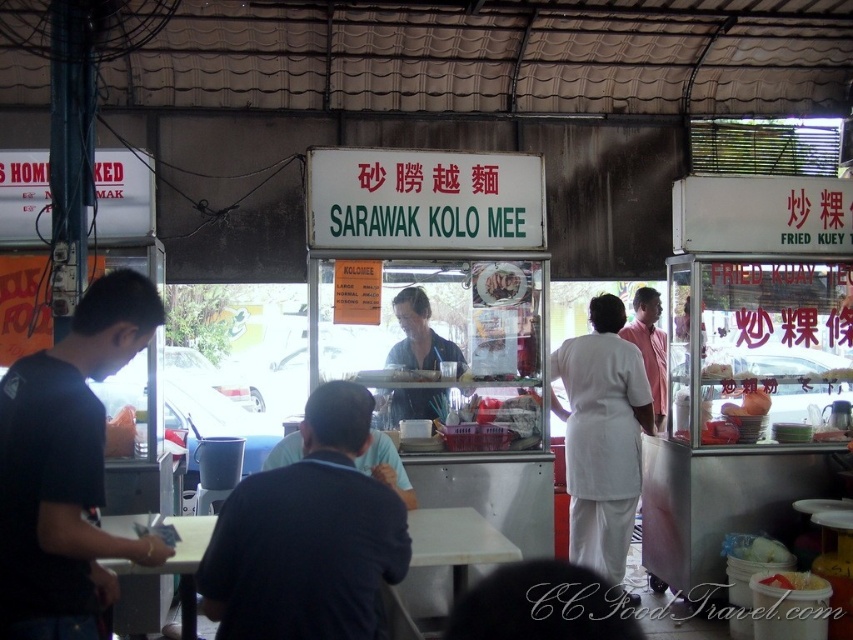
Question: Is pink cotton shirt at center thinner than white matte bowl at center?

Choices:
 (A) yes
 (B) no

Answer: (B)

Question: Is metallic silver fried kuey teow cart at right in front of dark blue shirt at center?

Choices:
 (A) no
 (B) yes

Answer: (A)

Question: Among these objects, which one is nearest to the camera?

Choices:
 (A) metallic silver fried kuey teow cart at right
 (B) white fabric shirt at center
 (C) dark blue shirt at center
 (D) white matte bowl at center

Answer: (C)

Question: Does metallic silver fried kuey teow cart at right come in front of white glossy bowl at center?

Choices:
 (A) no
 (B) yes

Answer: (B)

Question: Which point is closer to the camera taking this photo?

Choices:
 (A) (251, 545)
 (B) (741, 452)
 (C) (648, 378)

Answer: (A)

Question: Which object is farther from the camera taking this photo?

Choices:
 (A) blue shirt at center
 (B) white glossy bowl at center
 (C) dark blue shirt at center

Answer: (B)